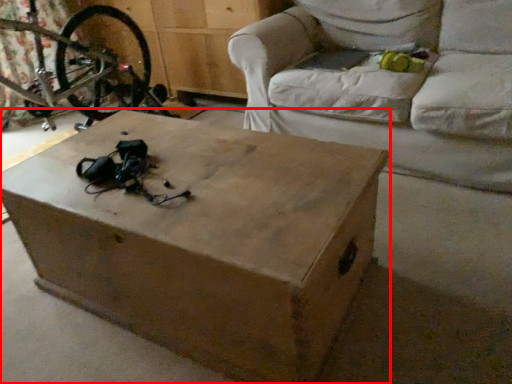
Question: Observing the image, what is the correct spatial positioning of table (annotated by the red box) in reference to studio couch?

Choices:
 (A) left
 (B) right

Answer: (A)